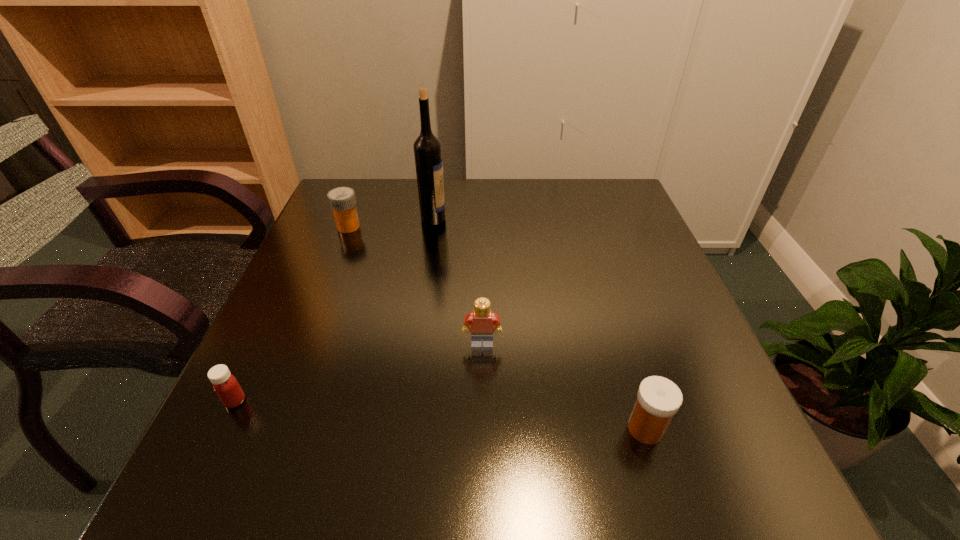
Where is `empty space between the Lego and the wine bottle`? This screenshot has height=540, width=960. empty space between the Lego and the wine bottle is located at coordinates (458, 281).

Image resolution: width=960 pixels, height=540 pixels. What are the coordinates of `unoccupied position between the Lego and the farthest medicine` in the screenshot? It's located at (416, 286).

The width and height of the screenshot is (960, 540). I want to click on blank region between the nearest medicine and the second farthest medicine, so click(441, 415).

Locate an element on the screen. The height and width of the screenshot is (540, 960). free space between the nearest object and the fourth object from left to right is located at coordinates (564, 387).

The image size is (960, 540). Identify the location of object that can be found as the fourth closest to the second nearest object. (658, 399).

Find the location of a particular element. This screenshot has height=540, width=960. object that ranks as the fourth closest to the third object from right to left is located at coordinates (658, 399).

In order to click on medicine that can be found as the third closest to the second object from right to left in this screenshot , I will do `click(342, 201)`.

Locate which medicine is the closest to the third farthest object. Please provide its 2D coordinates. Your answer should be formatted as a tuple, i.e. [(x, y)], where the tuple contains the x and y coordinates of a point satisfying the conditions above.

[(658, 399)]

This screenshot has width=960, height=540. Find the location of `free location that satisfies the following two spatial constraints: 1. on the label side of the second medicine from right to left; 2. on the back side of the rightmost medicine`. free location that satisfies the following two spatial constraints: 1. on the label side of the second medicine from right to left; 2. on the back side of the rightmost medicine is located at coordinates (269, 429).

Identify the location of vacant position in the image that satisfies the following two spatial constraints: 1. on the label of the third object from left to right; 2. on the left side of the nearest object. The width and height of the screenshot is (960, 540). pyautogui.click(x=403, y=429).